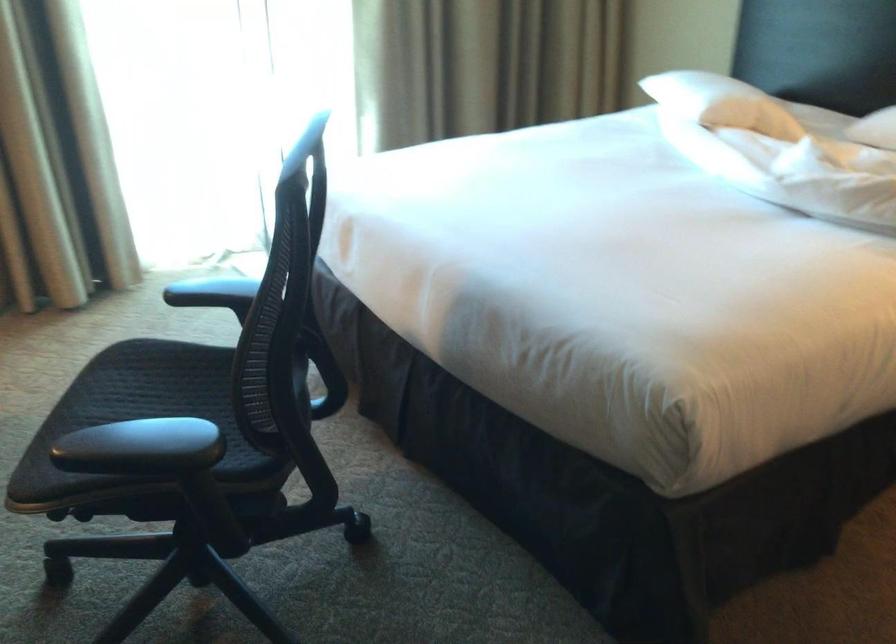
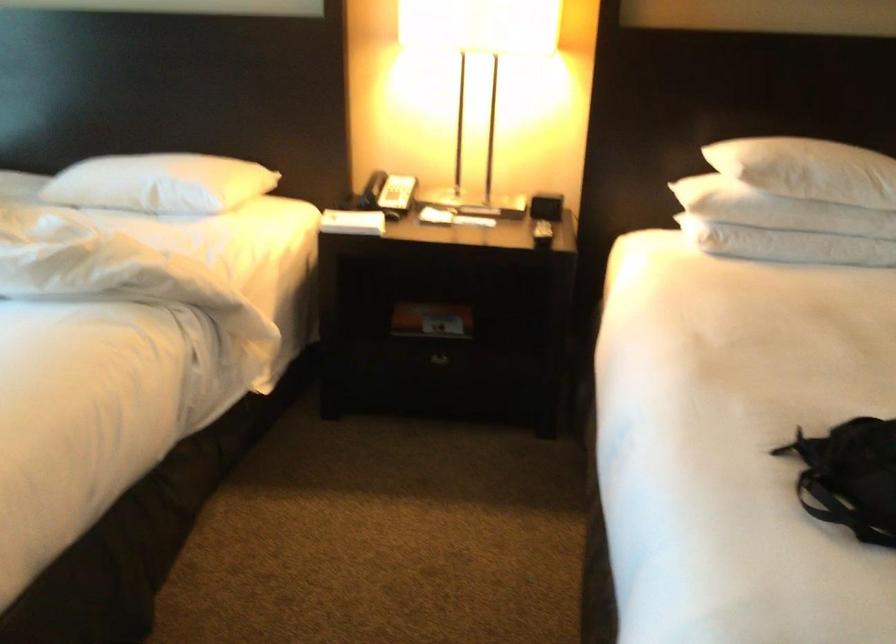
Question: How did the camera likely rotate?

Choices:
 (A) Left
 (B) Right
 (C) Up
 (D) Down

Answer: (B)